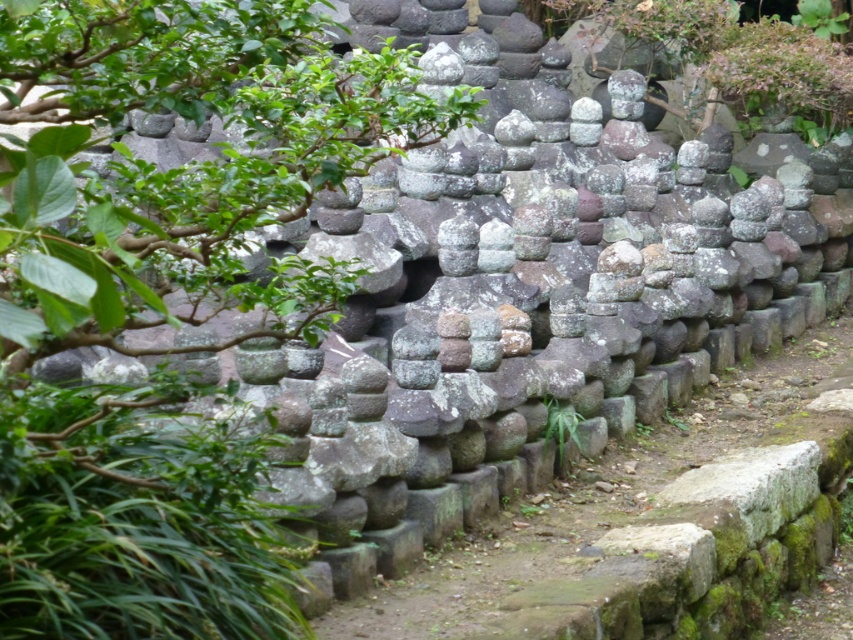
Between green leafy tree at center and mossy stone path at center, which one has more height?

mossy stone path at center

Is green leafy tree at center below mossy stone path at center?

No, green leafy tree at center is not below mossy stone path at center.

Which is behind, point (370, 124) or point (442, 564)?

The point (442, 564) is behind.

Where is `green leafy tree at center`? This screenshot has height=640, width=853. green leafy tree at center is located at coordinates (184, 164).